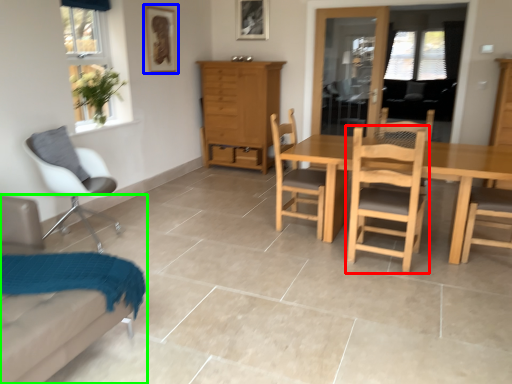
Question: Which object is the farthest from chair (highlighted by a red box)? Choose among these: picture frame (highlighted by a blue box) or chair (highlighted by a green box).

Choices:
 (A) picture frame
 (B) chair

Answer: (A)